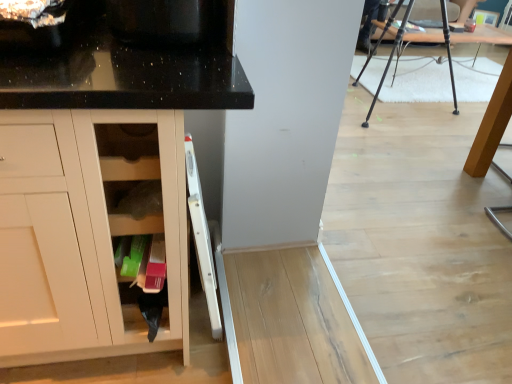
Describe the element at coordinates (172, 22) in the screenshot. This screenshot has height=384, width=512. I see `black glossy microwave at upper left` at that location.

Locate an element on the screen. The height and width of the screenshot is (384, 512). black glossy microwave at upper left is located at coordinates (172, 22).

Where is `black glossy microwave at upper left`? The image size is (512, 384). black glossy microwave at upper left is located at coordinates (172, 22).